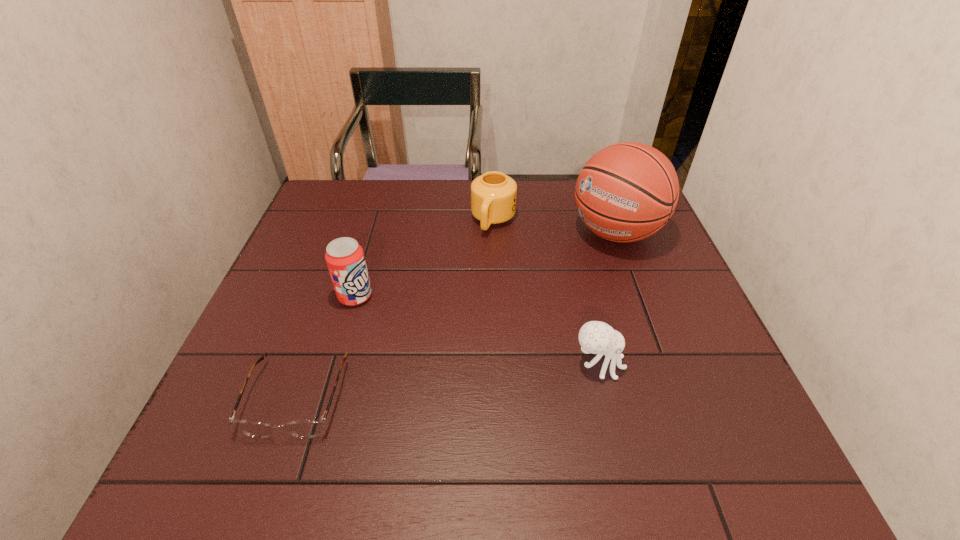
Find the location of a particular element. The image size is (960, 540). vacant spot on the desktop that is between the spectacles and the octopus and is positioned on the surface of the fourth shortest object is located at coordinates (463, 379).

Identify the location of free space on the desktop that is between the shortest object and the octopus and is positioned on the handle side of the mug. This screenshot has width=960, height=540. (422, 384).

Find the location of `vacant space on the desktop that is between the shortest object and the octopus and is positioned on the logo side of the tallest object`. vacant space on the desktop that is between the shortest object and the octopus and is positioned on the logo side of the tallest object is located at coordinates (420, 384).